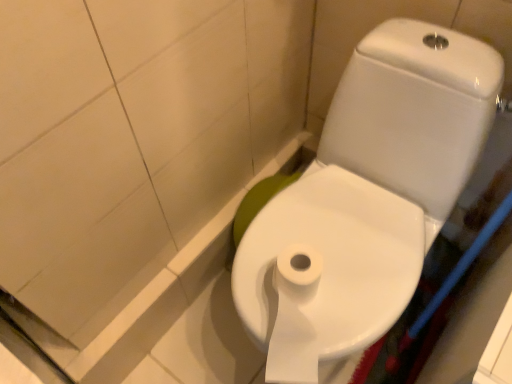
Where is `white glossy toilet at center`? Image resolution: width=512 pixels, height=384 pixels. white glossy toilet at center is located at coordinates (366, 199).

Consider the image. What is the approximate width of white glossy toilet at center?

It is 68.52 centimeters.

This screenshot has width=512, height=384. Describe the element at coordinates (366, 199) in the screenshot. I see `white glossy toilet at center` at that location.

The width and height of the screenshot is (512, 384). I want to click on white glossy toilet at center, so click(366, 199).